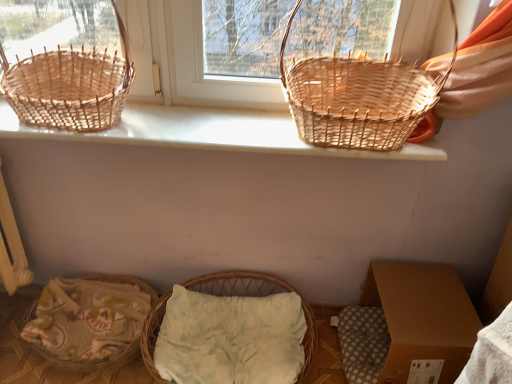
What do you see at coordinates (88, 321) in the screenshot? The width and height of the screenshot is (512, 384). I see `natural wicker basket at lower left` at bounding box center [88, 321].

Measure the distance between point (93, 68) and camera.

The distance of point (93, 68) from camera is 1.41 meters.

In order to face brown cardboard box at lower right, should I rotate leftwards or rightwards?

It's best to rotate right around 18.673 degrees.

Describe the element at coordinates (358, 98) in the screenshot. The image size is (512, 384). I see `woven natural basket at upper right, the 2th picnic basket in the bottom-to-top sequence` at that location.

Where is `natural wicker basket at lower left`? This screenshot has width=512, height=384. natural wicker basket at lower left is located at coordinates (88, 321).

How far apart are woven natural basket at left, which is the 1th picnic basket in left-to-right order, and woven natural basket at upper right, the first picnic basket viewed from the right?

The distance of woven natural basket at left, which is the 1th picnic basket in left-to-right order, from woven natural basket at upper right, the first picnic basket viewed from the right, is 28.33 inches.

Considering the sizes of objects woven natural basket at left, which appears as the 1th picnic basket when viewed from the top, and woven natural basket at upper right, which ranks as the 2th picnic basket in top-to-bottom order, in the image provided, who is thinner, woven natural basket at left, which appears as the 1th picnic basket when viewed from the top, or woven natural basket at upper right, which ranks as the 2th picnic basket in top-to-bottom order,?

With smaller width is woven natural basket at upper right, which ranks as the 2th picnic basket in top-to-bottom order.

How many degrees apart are the facing directions of woven natural basket at left, the third picnic basket ordered from the bottom, and woven natural basket at upper right, the first picnic basket viewed from the right?

The facing directions of woven natural basket at left, the third picnic basket ordered from the bottom, and woven natural basket at upper right, the first picnic basket viewed from the right, are 3.76e-05 degrees apart.

Considering the positions of points (28, 99) and (324, 121), is point (28, 99) farther from camera compared to point (324, 121)?

Yes, it is.

From a real-world perspective, who is located higher, woven wood baskets at upper center or brown cardboard box at lower right?

woven wood baskets at upper center is physically above.

Considering the relative sizes of woven wood baskets at upper center and brown cardboard box at lower right in the image provided, is woven wood baskets at upper center taller than brown cardboard box at lower right?

Incorrect, the height of woven wood baskets at upper center is not larger of that of brown cardboard box at lower right.

Would you say woven wood baskets at upper center is to the left or to the right of brown cardboard box at lower right in the picture?

Clearly, woven wood baskets at upper center is on the left of brown cardboard box at lower right in the image.

In the scene shown: Would you consider woven wood baskets at upper center to be distant from brown cardboard box at lower right?

No.

Is woven wood baskets at upper center smaller than woven natural basket at left, which is the 1th picnic basket in left-to-right order?

Correct, woven wood baskets at upper center occupies less space than woven natural basket at left, which is the 1th picnic basket in left-to-right order.

In terms of width, does woven wood baskets at upper center look wider or thinner when compared to woven natural basket at left, marked as the 3th picnic basket in a right-to-left arrangement?

Considering their sizes, woven wood baskets at upper center looks slimmer than woven natural basket at left, marked as the 3th picnic basket in a right-to-left arrangement.

At what (x,y) coordinates should I click in order to perform the action: click on window sill below the woven natural basket at left, which appears as the 1th picnic basket when viewed from the top (from the image's perspective). Please return your answer as a coordinate pair (x, y). The height and width of the screenshot is (384, 512). Looking at the image, I should click on (208, 133).

Is point (196, 116) closer to viewer compared to point (45, 58)?

No.

Between woven natural basket at left, the third picnic basket ordered from the bottom, and woven wicker basket at center, marked as the 1th picnic basket in a bottom-to-top arrangement, which one has larger width?

woven wicker basket at center, marked as the 1th picnic basket in a bottom-to-top arrangement.

Is woven natural basket at left, marked as the 3th picnic basket in a right-to-left arrangement, directly adjacent to woven wicker basket at center, placed as the 3th picnic basket when sorted from top to bottom?

No, woven natural basket at left, marked as the 3th picnic basket in a right-to-left arrangement, is not making contact with woven wicker basket at center, placed as the 3th picnic basket when sorted from top to bottom.

Based on the photo, from a real-world perspective, between woven natural basket at left, which appears as the 1th picnic basket when viewed from the top, and woven wicker basket at center, the second picnic basket positioned from the right, who is vertically higher?

woven natural basket at left, which appears as the 1th picnic basket when viewed from the top, from a real-world perspective.

Which object is more forward, woven wicker basket at center, placed as the second picnic basket when sorted from left to right, or brown cardboard box at lower right?

woven wicker basket at center, placed as the second picnic basket when sorted from left to right.

Considering the relative sizes of woven wicker basket at center, marked as the 1th picnic basket in a bottom-to-top arrangement, and brown cardboard box at lower right in the image provided, is woven wicker basket at center, marked as the 1th picnic basket in a bottom-to-top arrangement, bigger than brown cardboard box at lower right?

No, woven wicker basket at center, marked as the 1th picnic basket in a bottom-to-top arrangement, is not bigger than brown cardboard box at lower right.

Find the location of a particular element. cardboard box that appears above the woven wicker basket at center, the second picnic basket positioned from the right (from a real-world perspective) is located at coordinates (422, 320).

From the image's perspective, is woven wicker basket at center, the second picnic basket positioned from the right, located above brown cardboard box at lower right?

No, from the image's perspective, woven wicker basket at center, the second picnic basket positioned from the right, is not over brown cardboard box at lower right.

Between natural wicker basket at lower left and woven wicker basket at center, placed as the second picnic basket when sorted from left to right, which one has smaller width?

natural wicker basket at lower left is thinner.

Which object is closer to the camera taking this photo, natural wicker basket at lower left or woven wicker basket at center, placed as the 3th picnic basket when sorted from top to bottom?

Positioned in front is woven wicker basket at center, placed as the 3th picnic basket when sorted from top to bottom.

Could you tell me if natural wicker basket at lower left is facing woven wicker basket at center, the second picnic basket positioned from the right?

No, natural wicker basket at lower left does not turn towards woven wicker basket at center, the second picnic basket positioned from the right.

Locate an element on the screen. Image resolution: width=512 pixels, height=384 pixels. the 1st picnic basket in front of the woven wood baskets at upper center is located at coordinates (64, 63).

Looking at this image, is woven natural basket at left, which is the 1th picnic basket in left-to-right order, turned away from woven wood baskets at upper center?

No.

Measure the distance from woven natural basket at left, which is the 1th picnic basket in left-to-right order, to woven wood baskets at upper center.

woven natural basket at left, which is the 1th picnic basket in left-to-right order, is 9.73 inches from woven wood baskets at upper center.

From the image's perspective, is woven natural basket at left, which is the 1th picnic basket in left-to-right order, above or below woven wood baskets at upper center?

Clearly, from the image's perspective, woven natural basket at left, which is the 1th picnic basket in left-to-right order, is above woven wood baskets at upper center.

At what (x,y) coordinates should I click in order to perform the action: click on picnic basket above the woven natural basket at upper right, the first picnic basket viewed from the right (from the image's perspective). Please return your answer as a coordinate pair (x, y). This screenshot has width=512, height=384. Looking at the image, I should click on (64, 63).

You are a GUI agent. You are given a task and a screenshot of the screen. Output one action in this format:
    pyautogui.click(x=<x>, y=<y>)
    Task: Click on the window sill above the brown cardboard box at lower right (from a real-world perspective)
    The width and height of the screenshot is (512, 384).
    Given the screenshot: What is the action you would take?
    pyautogui.click(x=208, y=133)

Estimate the real-world distances between objects in this image. Which object is further from woven wicker basket at center, placed as the 3th picnic basket when sorted from top to bottom, woven natural basket at upper right, the first picnic basket viewed from the right, or brown cardboard box at lower right?

woven natural basket at upper right, the first picnic basket viewed from the right, lies further to woven wicker basket at center, placed as the 3th picnic basket when sorted from top to bottom, than the other object.

When comparing their distances from natural wicker basket at lower left, does woven wood baskets at upper center or woven natural basket at left, which appears as the 1th picnic basket when viewed from the top, seem further?

Based on the image, woven natural basket at left, which appears as the 1th picnic basket when viewed from the top, appears to be further to natural wicker basket at lower left.

When comparing their distances from woven wood baskets at upper center, does woven wicker basket at center, placed as the 3th picnic basket when sorted from top to bottom, or woven natural basket at upper right, marked as the third picnic basket in a left-to-right arrangement, seem further?

The object further to woven wood baskets at upper center is woven wicker basket at center, placed as the 3th picnic basket when sorted from top to bottom.

Looking at the image, which one is located closer to brown cardboard box at lower right, woven natural basket at left, which appears as the 1th picnic basket when viewed from the top, or woven wood baskets at upper center?

woven wood baskets at upper center lies closer to brown cardboard box at lower right than the other object.

Estimate the real-world distances between objects in this image. Which object is further from brown cardboard box at lower right, natural wicker basket at lower left or woven natural basket at left, which is the 1th picnic basket in left-to-right order?

woven natural basket at left, which is the 1th picnic basket in left-to-right order, is positioned further to the anchor brown cardboard box at lower right.

Estimate the real-world distances between objects in this image. Which object is closer to woven wicker basket at center, placed as the second picnic basket when sorted from left to right, woven natural basket at left, marked as the 3th picnic basket in a right-to-left arrangement, or woven wood baskets at upper center?

woven wood baskets at upper center lies closer to woven wicker basket at center, placed as the second picnic basket when sorted from left to right, than the other object.

Considering their positions, is woven wood baskets at upper center positioned closer to woven natural basket at upper right, the 2th picnic basket in the bottom-to-top sequence, than woven wicker basket at center, marked as the 1th picnic basket in a bottom-to-top arrangement?

Based on the image, woven wood baskets at upper center appears to be nearer to woven natural basket at upper right, the 2th picnic basket in the bottom-to-top sequence.

From the image, which object appears to be nearer to woven natural basket at left, the third picnic basket ordered from the bottom, woven wicker basket at center, placed as the second picnic basket when sorted from left to right, or natural wicker basket at lower left?

Based on the image, natural wicker basket at lower left appears to be nearer to woven natural basket at left, the third picnic basket ordered from the bottom.

Locate an element on the screen. The height and width of the screenshot is (384, 512). window sill situated between woven natural basket at left, marked as the 3th picnic basket in a right-to-left arrangement, and brown cardboard box at lower right from left to right is located at coordinates (208, 133).

At what (x,y) coordinates should I click in order to perform the action: click on cardboard box between woven wood baskets at upper center and woven wicker basket at center, placed as the 3th picnic basket when sorted from top to bottom, in the up-down direction. Please return your answer as a coordinate pair (x, y). This screenshot has height=384, width=512. Looking at the image, I should click on (422, 320).

The image size is (512, 384). Identify the location of window sill that lies between woven natural basket at upper right, the 2th picnic basket in the bottom-to-top sequence, and woven wicker basket at center, placed as the 3th picnic basket when sorted from top to bottom, from top to bottom. (208, 133).

At what (x,y) coordinates should I click in order to perform the action: click on basket between woven natural basket at upper right, marked as the third picnic basket in a left-to-right arrangement, and woven wicker basket at center, the second picnic basket positioned from the right, in the vertical direction. Please return your answer as a coordinate pair (x, y). This screenshot has height=384, width=512. Looking at the image, I should click on (88, 321).